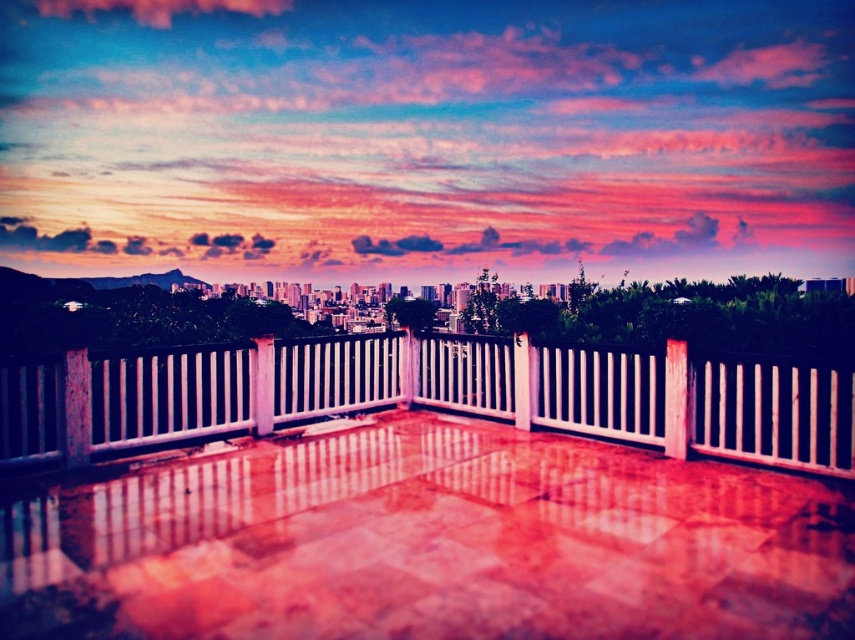
You are standing on the balcony and want to place a large potted plant on the smooth concrete deck at center. Considering the size of the white glossy fence at center, will there be enough space for the plant?

The smooth concrete deck at center has a larger size compared to the white glossy fence at center, so there should be sufficient space to place the large potted plant on the smooth concrete deck at center.

You are standing on the balcony and want to place a potted plant on the smooth concrete deck at center. However, there is already a decorative statue on the white glossy fence at center. Can you place the potted plant below the statue without it being obstructed by the fence?

Yes, the smooth concrete deck at center is located below the white glossy fence at center, so placing the potted plant there would position it under the statue on the fence without obstruction.